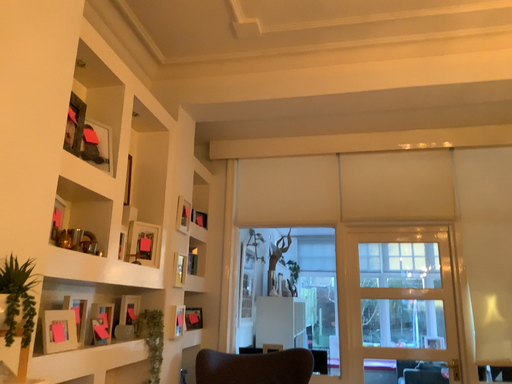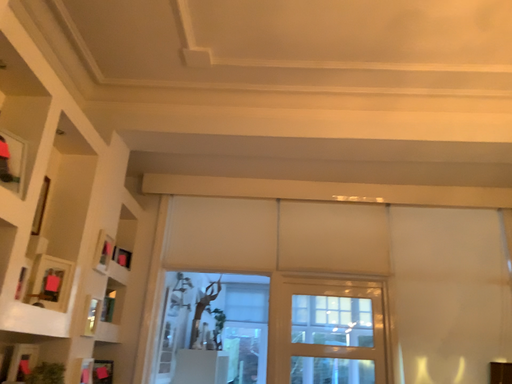
Question: Which way did the camera rotate in the video?

Choices:
 (A) rotated right
 (B) rotated left

Answer: (A)